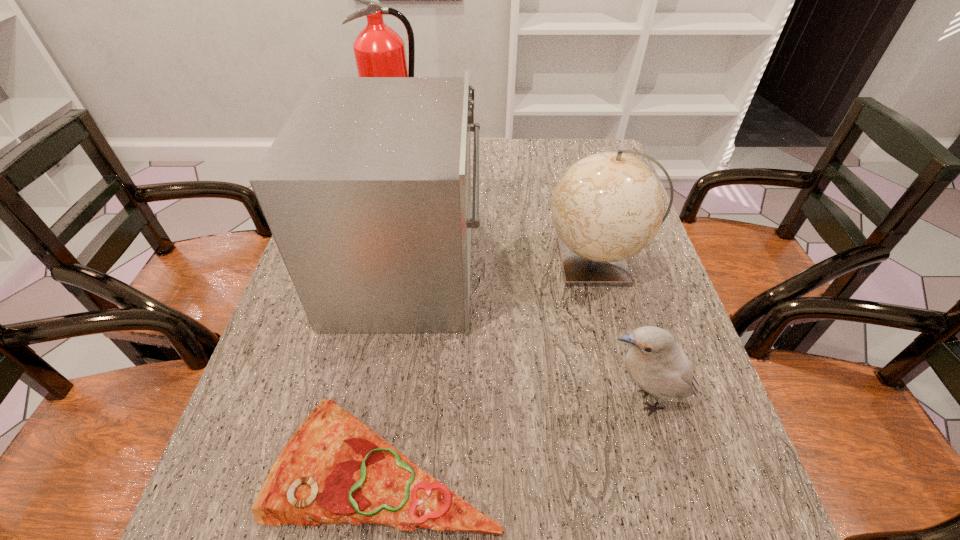
Locate an element on the screen. This screenshot has height=540, width=960. empty space that is in between the bird and the fourth shortest object is located at coordinates (527, 335).

Find the location of a particular element. free point between the third tallest object and the fire extinguisher is located at coordinates (497, 209).

Find the location of a particular element. Image resolution: width=960 pixels, height=540 pixels. free area in between the toaster oven and the shortest object is located at coordinates click(x=396, y=366).

The image size is (960, 540). I want to click on free spot between the bird and the globe, so click(x=622, y=332).

Identify which object is the fourth closest to the pizza. Please provide its 2D coordinates. Your answer should be formatted as a tuple, i.e. [(x, y)], where the tuple contains the x and y coordinates of a point satisfying the conditions above.

[(379, 51)]

The image size is (960, 540). I want to click on object identified as the third closest to the shortest object, so click(608, 206).

Where is `free space that satisfies the following two spatial constraints: 1. at the nozzle of the shortest object; 2. on the left side of the fire extinguisher`? The width and height of the screenshot is (960, 540). free space that satisfies the following two spatial constraints: 1. at the nozzle of the shortest object; 2. on the left side of the fire extinguisher is located at coordinates (322, 463).

This screenshot has width=960, height=540. Identify the location of free region that satisfies the following two spatial constraints: 1. on the back side of the shortest object; 2. on the front panel of the toaster oven. (414, 269).

Where is `vacant space that satisfies the following two spatial constraints: 1. on the front panel of the second tallest object; 2. on the left side of the shortest object`? This screenshot has height=540, width=960. vacant space that satisfies the following two spatial constraints: 1. on the front panel of the second tallest object; 2. on the left side of the shortest object is located at coordinates [376, 463].

The height and width of the screenshot is (540, 960). What are the coordinates of `vacant space that satisfies the following two spatial constraints: 1. at the nozzle of the shortest object; 2. on the right side of the farthest object` in the screenshot? It's located at (322, 463).